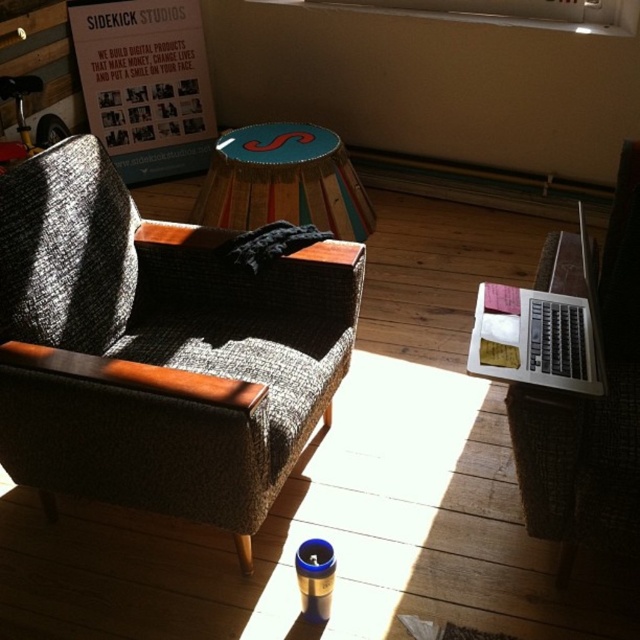
Is the position of textured gray couch at left more distant than that of wooden stool at center?

No, it is in front of wooden stool at center.

Is textured gray couch at left smaller than wooden stool at center?

No, textured gray couch at left is not smaller than wooden stool at center.

Is point (304, 396) farther from viewer compared to point (326, 157)?

No, (304, 396) is closer to viewer.

Where is `textured gray couch at left`? textured gray couch at left is located at coordinates (157, 349).